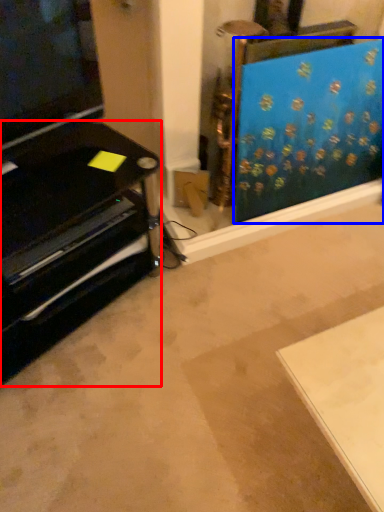
Question: Among these objects, which one is nearest to the camera, furniture (highlighted by a red box) or curtain (highlighted by a blue box)?

Choices:
 (A) furniture
 (B) curtain

Answer: (A)